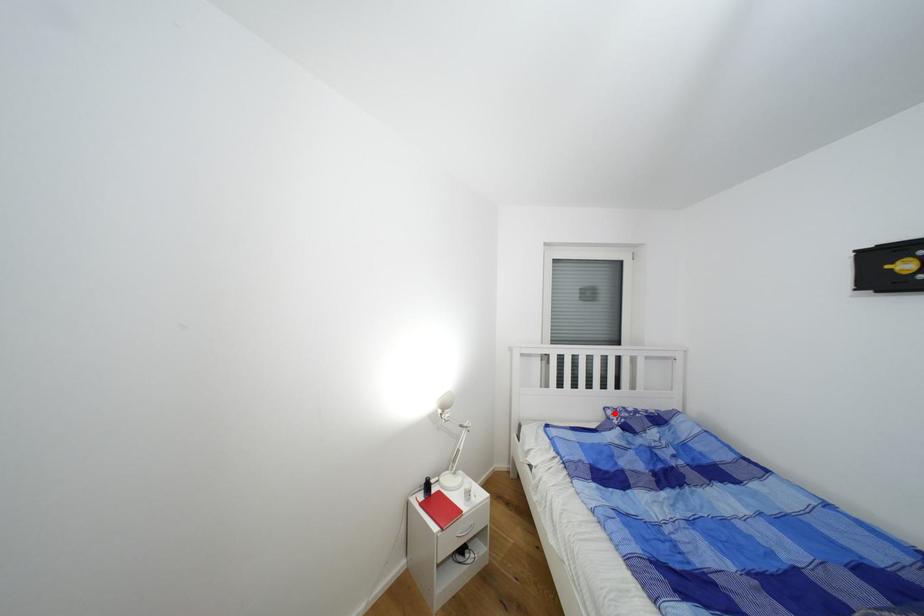
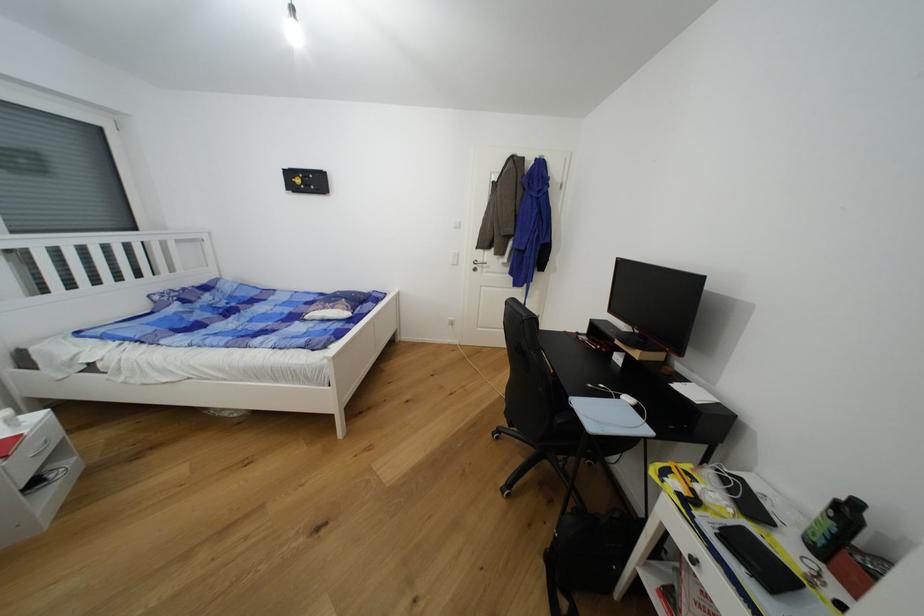
Where in the second image is the point corresponding to the highlighted location from the first image?

(162, 299)